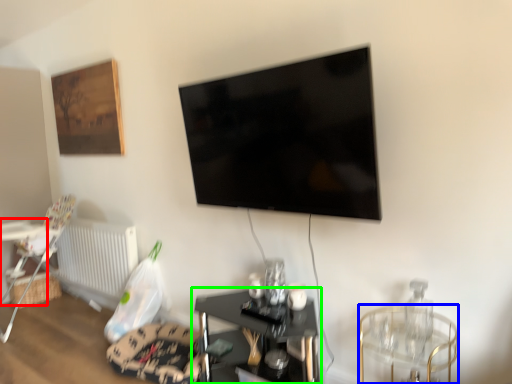
Question: Considering the real-world distances, which object is closest to table (highlighted by a red box)? glass table (highlighted by a blue box) or table (highlighted by a green box).

Choices:
 (A) glass table
 (B) table

Answer: (B)